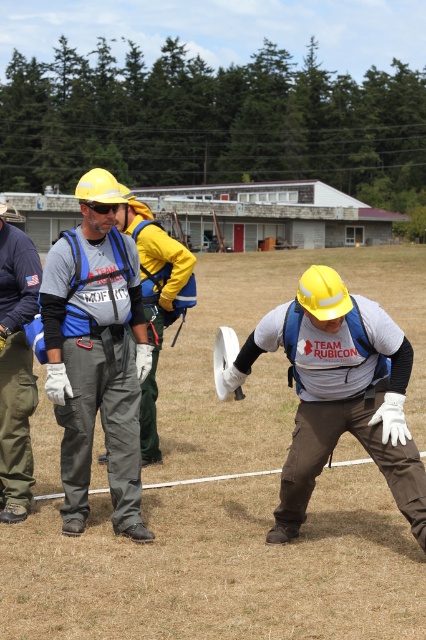
You are a photographer trying to capture a closeup shot of the white fabric glove at lower center. However, the matte gray jumpsuit at center is blocking your view. Can you estimate whether the jumpsuit is wider than the glove?

The matte gray jumpsuit at center is wider than the white fabric glove at lower center, so the jumpsuit is indeed blocking the view of the glove.